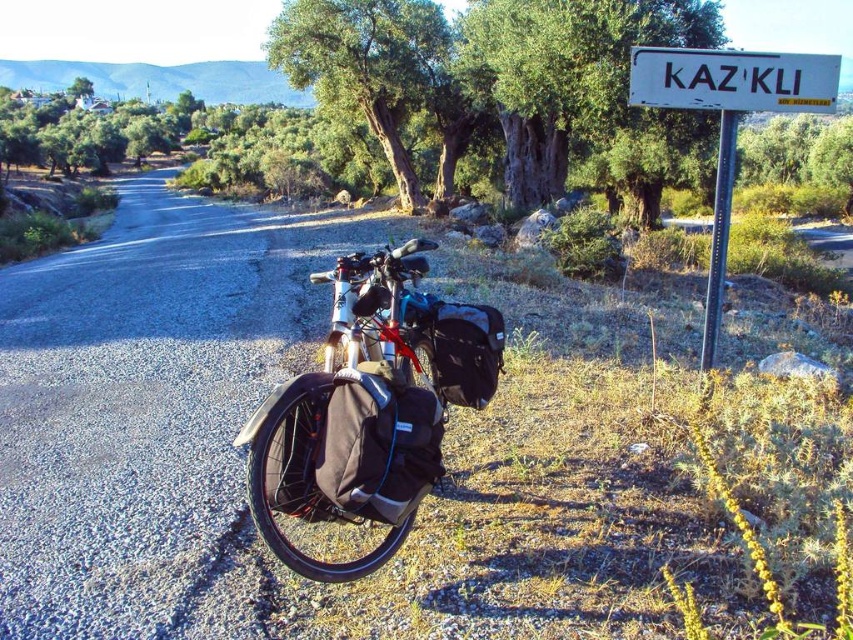
You are a cyclist passing by the white plastic sign at upper right and the white plastic sign at upper center. Which sign is wider?

The white plastic sign at upper right is wider than the white plastic sign at upper center.

You are a photographer trying to capture the white plastic sign at upper right without the green rough bark tree at center blocking it. Based on their positions, can you determine if the tree is in front of or behind the sign?

The green rough bark tree at center is positioned over the white plastic sign at upper right, meaning the tree is in front of the sign and blocking it.